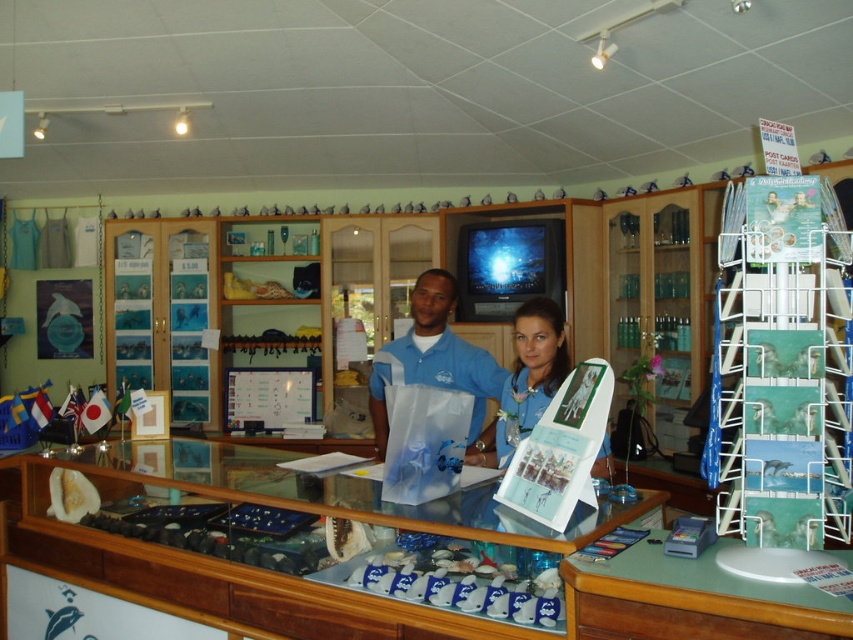
Between point (428, 333) and point (534, 397), which one is positioned in front?

Positioned in front is point (534, 397).

Is point (438, 385) positioned behind point (538, 397)?

That is True.

Locate an element on the screen. The image size is (853, 640). blue matte shirt at center is located at coordinates (434, 360).